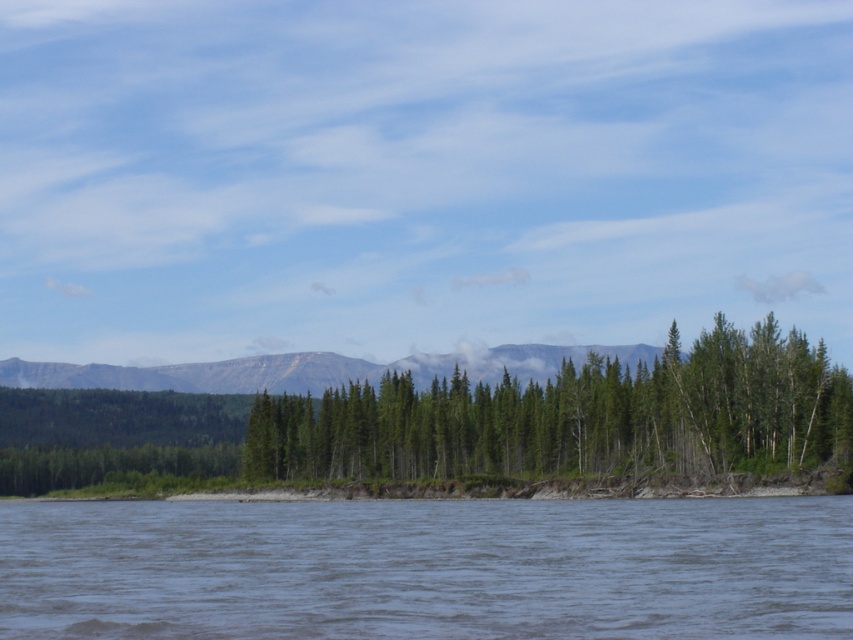
Does gray water at lower center have a lesser height compared to green matte trees at center?

Yes.

Does gray water at lower center appear on the right side of green matte trees at center?

Incorrect, gray water at lower center is not on the right side of green matte trees at center.

You are a GUI agent. You are given a task and a screenshot of the screen. Output one action in this format:
    pyautogui.click(x=<x>, y=<y>)
    Task: Click on the gray water at lower center
    The image size is (853, 640).
    Given the screenshot: What is the action you would take?
    pyautogui.click(x=427, y=568)

Does point (392, 467) come farther from viewer compared to point (22, 384)?

That is False.

Image resolution: width=853 pixels, height=640 pixels. I want to click on green matte trees at center, so click(573, 417).

This screenshot has height=640, width=853. I want to click on green matte trees at center, so click(x=573, y=417).

Who is lower down, gray water at lower center or rocky gray mountain at center?

gray water at lower center is lower down.

Is point (18, 502) positioned before point (308, 378)?

Yes, point (18, 502) is closer to viewer.

The width and height of the screenshot is (853, 640). I want to click on gray water at lower center, so click(427, 568).